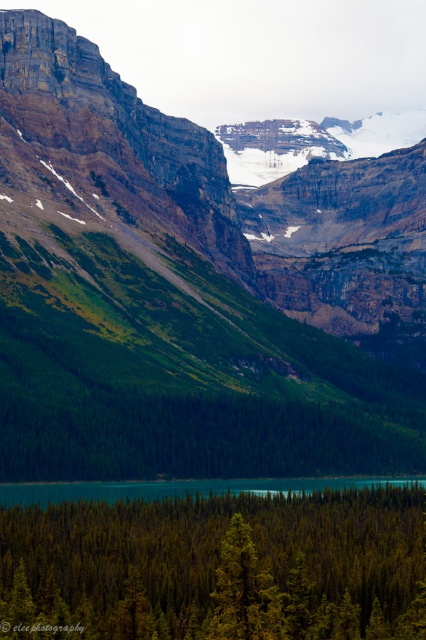
Question: Among these points, which one is nearest to the camera?

Choices:
 (A) (57, 428)
 (B) (319, 497)
 (C) (204, 492)

Answer: (A)

Question: Which of the following is the closest to the observer?

Choices:
 (A) (140, 444)
 (B) (402, 484)
 (C) (60, 582)

Answer: (C)

Question: Can you confirm if green mossy rock at center is thinner than teal glossy water at center?

Choices:
 (A) yes
 (B) no

Answer: (B)

Question: Can you confirm if green matte tree at center is positioned to the right of teal glossy water at center?

Choices:
 (A) no
 (B) yes

Answer: (B)

Question: Which point is closer to the camera?

Choices:
 (A) green matte tree at center
 (B) teal glossy water at center
 (C) green mossy rock at center

Answer: (A)

Question: In this image, where is green mossy rock at center located relative to green matte tree at center?

Choices:
 (A) below
 (B) above

Answer: (B)